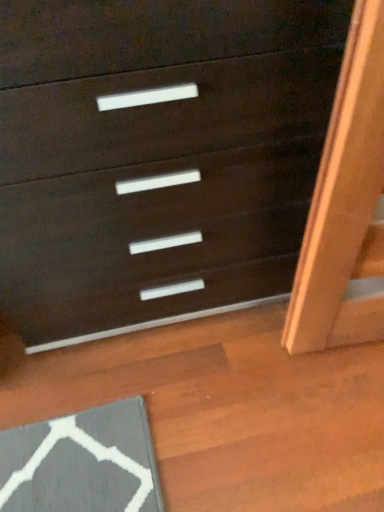
Locate an element on the screen. The width and height of the screenshot is (384, 512). matte black dresser at center is located at coordinates (157, 157).

The width and height of the screenshot is (384, 512). What do you see at coordinates (157, 157) in the screenshot?
I see `matte black dresser at center` at bounding box center [157, 157].

What is the approximate height of matte black dresser at center?

matte black dresser at center is 94.81 centimeters in height.

At what (x,y) coordinates should I click in order to perform the action: click on matte black dresser at center. Please return your answer as a coordinate pair (x, y). The height and width of the screenshot is (512, 384). Looking at the image, I should click on (157, 157).